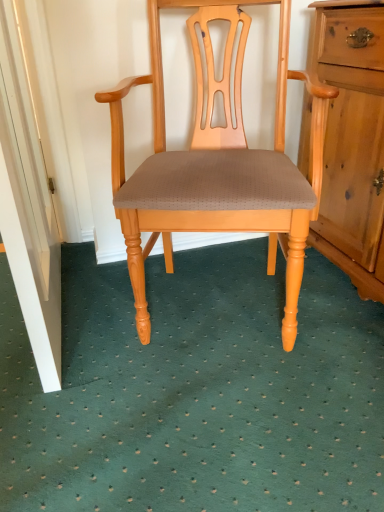
Question: From a real-world perspective, is light wood/finely carvedchair at center located higher than white painted wood door at lower left?

Choices:
 (A) no
 (B) yes

Answer: (A)

Question: Is light wood/finely carvedchair at center completely or partially outside of white painted wood door at lower left?

Choices:
 (A) no
 (B) yes

Answer: (B)

Question: Is light wood/finely carvedchair at center wider than white painted wood door at lower left?

Choices:
 (A) no
 (B) yes

Answer: (B)

Question: Does light wood/finely carvedchair at center have a greater height compared to white painted wood door at lower left?

Choices:
 (A) yes
 (B) no

Answer: (B)

Question: From the image's perspective, is light wood/finely carvedchair at center on top of white painted wood door at lower left?

Choices:
 (A) no
 (B) yes

Answer: (A)

Question: Is light wood/finely carvedchair at center turned away from white painted wood door at lower left?

Choices:
 (A) yes
 (B) no

Answer: (B)

Question: Is white painted wood door at lower left far from light wood/finely carvedchair at center?

Choices:
 (A) no
 (B) yes

Answer: (A)

Question: Is the position of white painted wood door at lower left more distant than that of light wood/finely carvedchair at center?

Choices:
 (A) yes
 (B) no

Answer: (B)

Question: Considering the relative sizes of white painted wood door at lower left and light wood/finely carvedchair at center in the image provided, is white painted wood door at lower left wider than light wood/finely carvedchair at center?

Choices:
 (A) no
 (B) yes

Answer: (A)

Question: From a real-world perspective, is white painted wood door at lower left physically above light wood/finely carvedchair at center?

Choices:
 (A) yes
 (B) no

Answer: (A)

Question: Considering the relative positions of white painted wood door at lower left and light wood/finely carvedchair at center in the image provided, is white painted wood door at lower left to the left of light wood/finely carvedchair at center from the viewer's perspective?

Choices:
 (A) yes
 (B) no

Answer: (A)

Question: Is white painted wood door at lower left shorter than light wood/finely carvedchair at center?

Choices:
 (A) yes
 (B) no

Answer: (B)

Question: Considering the positions of white painted wood door at lower left and light wood/finely carvedchair at center in the image, is white painted wood door at lower left taller or shorter than light wood/finely carvedchair at center?

Choices:
 (A) tall
 (B) short

Answer: (A)